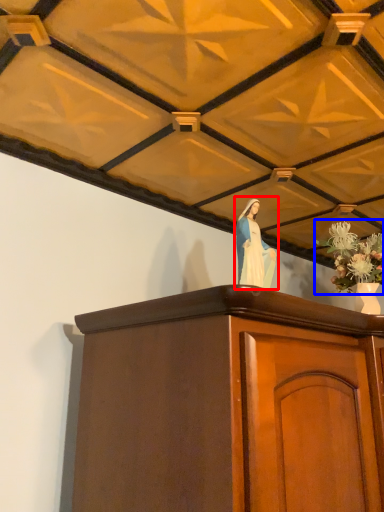
Question: Among these objects, which one is farthest to the camera, woman (highlighted by a red box) or floral arrangement (highlighted by a blue box)?

Choices:
 (A) woman
 (B) floral arrangement

Answer: (B)